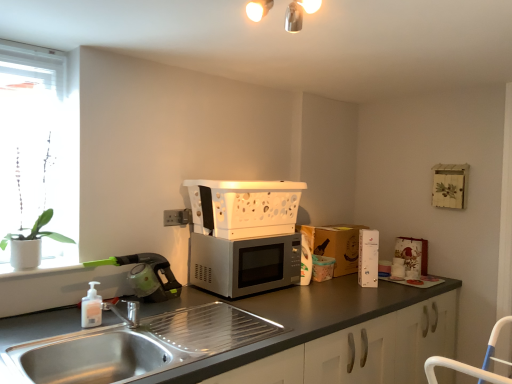
Locate an element on the screen. This screenshot has width=512, height=384. free spot in front of green plastic vacuum cleaner at left, which is the 3th appliance in right-to-left order is located at coordinates (102, 317).